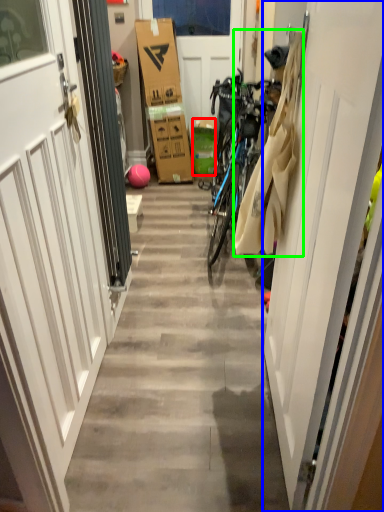
Question: Which object is the farthest from box (highlighted by a red box)? Choose among these: door (highlighted by a blue box) or laundry (highlighted by a green box).

Choices:
 (A) door
 (B) laundry

Answer: (A)